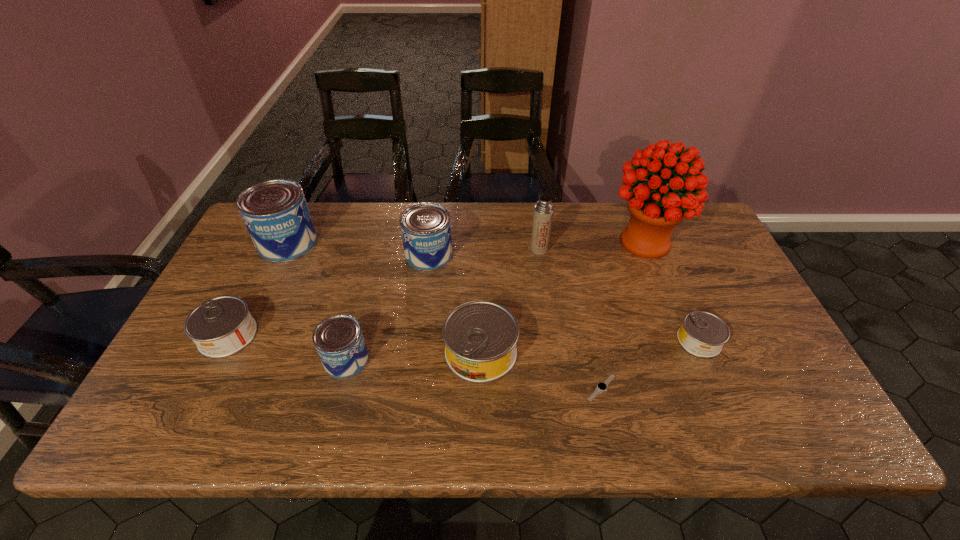
In order to click on the tallest object in this screenshot , I will do `click(655, 208)`.

You are a GUI agent. You are given a task and a screenshot of the screen. Output one action in this format:
    pyautogui.click(x=<x>, y=<y>)
    Task: Click on the fourth object from right to left
    The image size is (960, 540).
    Given the screenshot: What is the action you would take?
    pyautogui.click(x=543, y=211)

Identify the location of the leftmost blue can. (275, 212).

The height and width of the screenshot is (540, 960). Find the location of `the biggest blue can`. the biggest blue can is located at coordinates (275, 212).

This screenshot has height=540, width=960. In order to click on the second tallest can in this screenshot , I will do `click(425, 227)`.

Where is `the second smallest blue can`? This screenshot has width=960, height=540. the second smallest blue can is located at coordinates (425, 227).

Where is `the smallest blue can`? the smallest blue can is located at coordinates (x=339, y=341).

In order to click on the third object from left to right in this screenshot , I will do (x=339, y=341).

Locate an element on the screen. The image size is (960, 540). the second silver can from right to left is located at coordinates (480, 337).

Where is `the leftmost silver can`? Image resolution: width=960 pixels, height=540 pixels. the leftmost silver can is located at coordinates (222, 326).